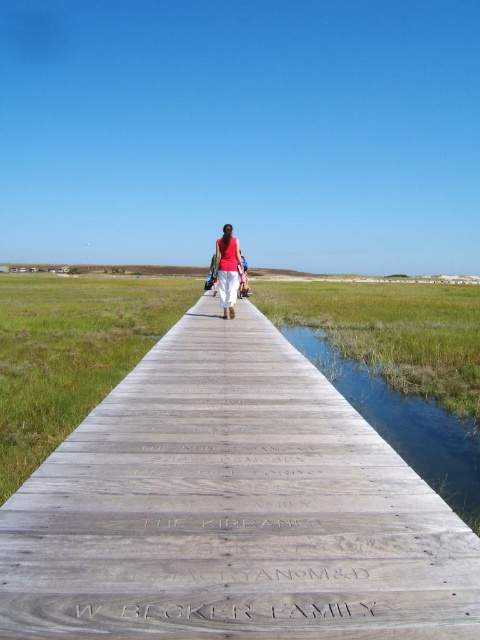
Question: Is green grassy salt marsh at center positioned before matte red shirt at center?

Choices:
 (A) yes
 (B) no

Answer: (A)

Question: Is wooden at center below green grassy salt marsh at center?

Choices:
 (A) yes
 (B) no

Answer: (B)

Question: Which of the following is the farthest from the observer?

Choices:
 (A) (237, 244)
 (B) (60, 506)

Answer: (A)

Question: Which point is farther to the camera?

Choices:
 (A) wooden at center
 (B) green grassy salt marsh at center
 (C) matte red shirt at center

Answer: (C)

Question: Which of these objects is positioned closest to the matte red shirt at center?

Choices:
 (A) green grassy salt marsh at center
 (B) wooden at center

Answer: (A)

Question: Can you confirm if green grassy salt marsh at center is positioned above matte red shirt at center?

Choices:
 (A) no
 (B) yes

Answer: (A)